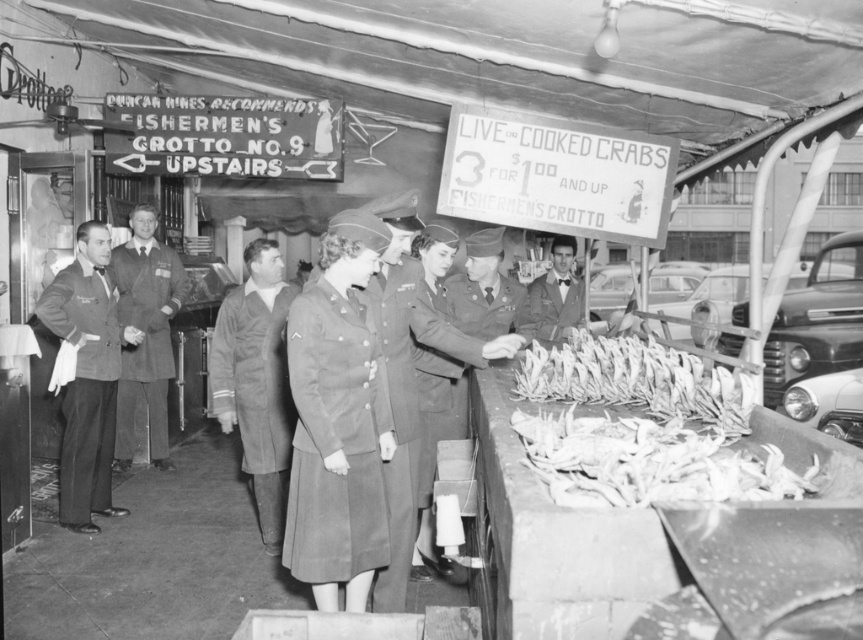
Is smooth dark suit at left below uniform matte fabric at center?

Indeed, smooth dark suit at left is positioned under uniform matte fabric at center.

From the picture: Is smooth dark suit at left smaller than uniform matte fabric at center?

Actually, smooth dark suit at left might be larger than uniform matte fabric at center.

Is point (167, 337) farther from viewer compared to point (413, 321)?

Yes, it is behind point (413, 321).

Find the location of `smooth dark suit at left`. smooth dark suit at left is located at coordinates (145, 333).

Can you confirm if dark wool coat at center is smaller than smooth black suit at left?

No.

Does point (231, 356) lie in front of point (87, 284)?

That is True.

What are the coordinates of `dark wool coat at center` in the screenshot? It's located at (256, 380).

Does white crabs at center lie behind smooth black suit at left?

No, it is in front of smooth black suit at left.

Is white crabs at center closer to the viewer compared to smooth black suit at left?

That is True.

Is point (745, 461) positioned before point (61, 442)?

Yes, point (745, 461) is in front of point (61, 442).

Locate an element on the screen. white crabs at center is located at coordinates (641, 429).